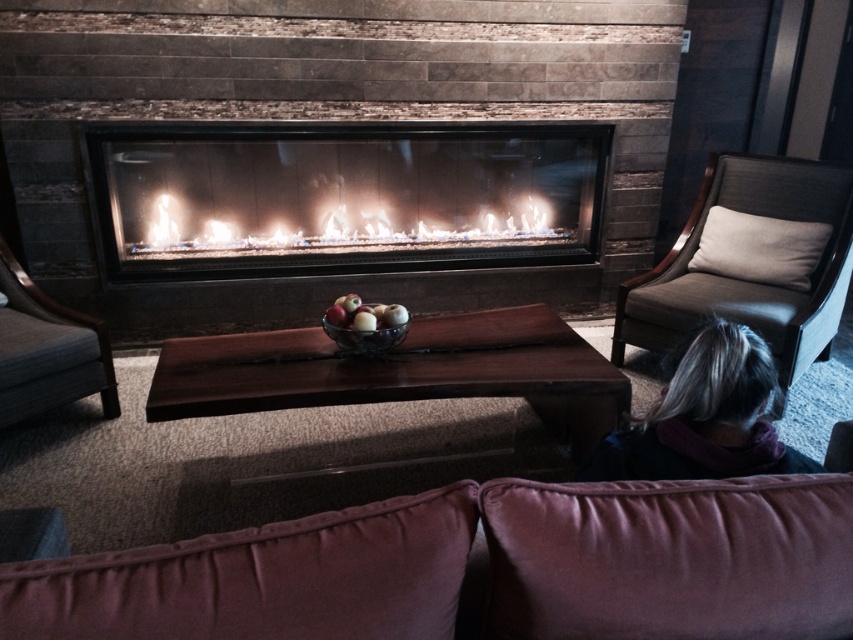
Is velvet maroon couch at lower center shorter than gray woolen scarf at lower right?

Yes, velvet maroon couch at lower center is shorter than gray woolen scarf at lower right.

Is velvet maroon couch at lower center bigger than gray woolen scarf at lower right?

Incorrect, velvet maroon couch at lower center is not larger than gray woolen scarf at lower right.

Locate an element on the screen. The height and width of the screenshot is (640, 853). velvet maroon couch at lower center is located at coordinates (489, 568).

What do you see at coordinates (747, 280) in the screenshot?
I see `brown leather armchair at right` at bounding box center [747, 280].

Is point (764, 177) positioned before point (606, 445)?

No.

The width and height of the screenshot is (853, 640). Identify the location of brown leather armchair at right. (747, 280).

Does gray woolen scarf at lower right have a greater width compared to white gas fire at center?

No.

Is gray woolen scarf at lower right below white gas fire at center?

Correct, gray woolen scarf at lower right is located below white gas fire at center.

Which is behind, point (689, 378) or point (337, 230)?

Positioned behind is point (337, 230).

This screenshot has height=640, width=853. What are the coordinates of `gray woolen scarf at lower right` in the screenshot? It's located at (705, 417).